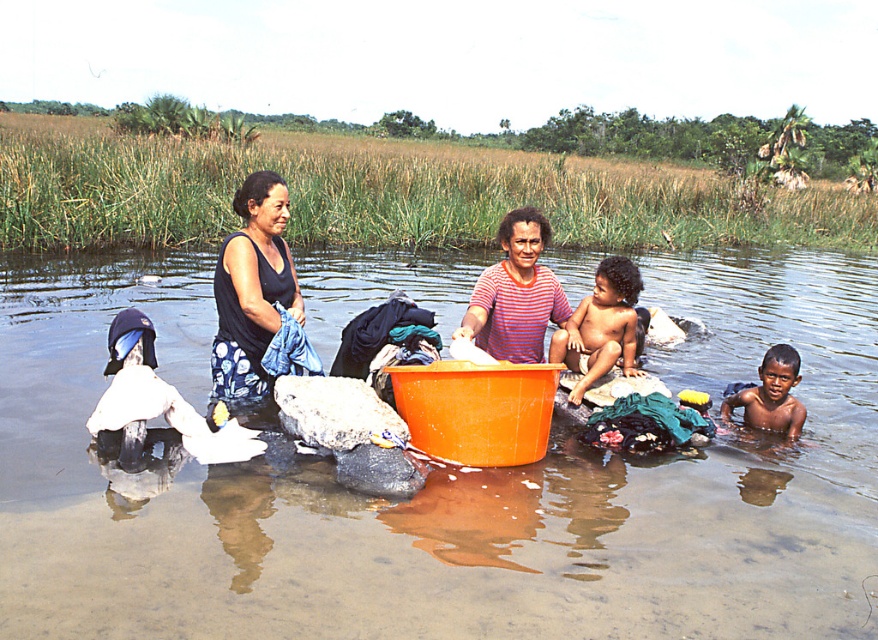
Between dark brown skin at center and dark brown skin boy at lower right, which one has less height?

dark brown skin boy at lower right

Between dark brown skin at center and dark brown skin boy at lower right, which one has more height?

With more height is dark brown skin at center.

Is point (585, 308) closer to camera compared to point (785, 412)?

Yes, point (585, 308) is in front of point (785, 412).

The height and width of the screenshot is (640, 878). What are the coordinates of `dark brown skin at center` in the screenshot? It's located at (601, 326).

Who is more distant from viewer, (799, 520) or (607, 340)?

The point (607, 340) is more distant.

Based on the photo, who is more distant from viewer, (711, 588) or (631, 285)?

Point (631, 285)

The image size is (878, 640). Identify the location of clear water at center. (444, 484).

How much distance is there between black fabric at center and striped cotton shirt at center?

black fabric at center and striped cotton shirt at center are 4.92 feet apart.

Can you confirm if black fabric at center is positioned below striped cotton shirt at center?

Yes.

Between point (216, 392) and point (486, 285), which one is positioned in front?

Point (216, 392) is in front.

Find the location of a particular element. Image resolution: width=878 pixels, height=640 pixels. black fabric at center is located at coordinates (245, 326).